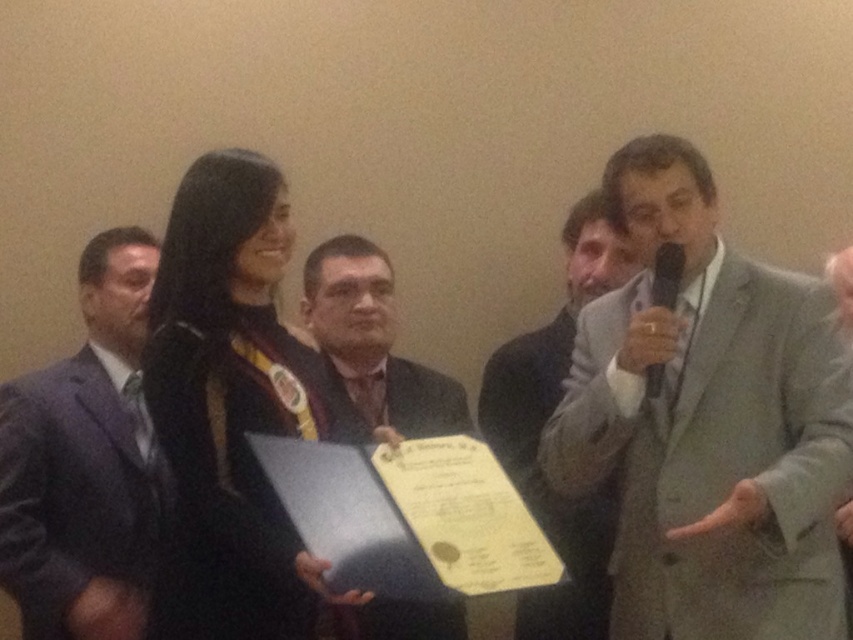
Question: Among these objects, which one is farthest from the camera?

Choices:
 (A) matte black microphone at right
 (B) black satin business suit at center
 (C) matte black suit at center

Answer: (C)

Question: Can you confirm if matte black suit at center is positioned to the left of black plastic microphone at upper right?

Choices:
 (A) yes
 (B) no

Answer: (A)

Question: Which of the following is the closest to the observer?

Choices:
 (A) dark gray suit at left
 (B) matte black microphone at right
 (C) matte black suit at center
 (D) black satin business suit at center

Answer: (D)

Question: Among these objects, which one is farthest from the camera?

Choices:
 (A) matte black hand at center
 (B) black satin business suit at center
 (C) gray suit at right
 (D) black plastic microphone at upper right

Answer: (D)

Question: Is gray suit at right above dark gray suit at left?

Choices:
 (A) yes
 (B) no

Answer: (A)

Question: In this image, where is gray suit at right located relative to black plastic microphone at upper right?

Choices:
 (A) left
 (B) right

Answer: (B)